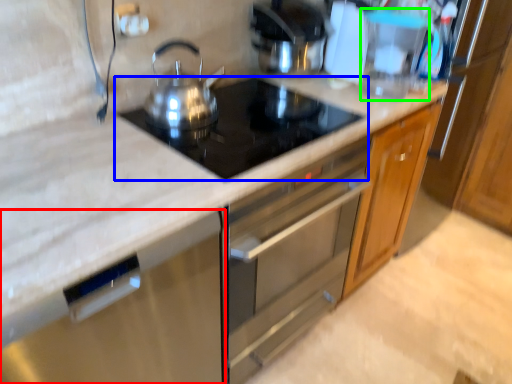
Question: Which object is positioned closest to dish washer (highlighted by a red box)? Select from gas stove (highlighted by a blue box) and appliance (highlighted by a green box).

Choices:
 (A) gas stove
 (B) appliance

Answer: (A)